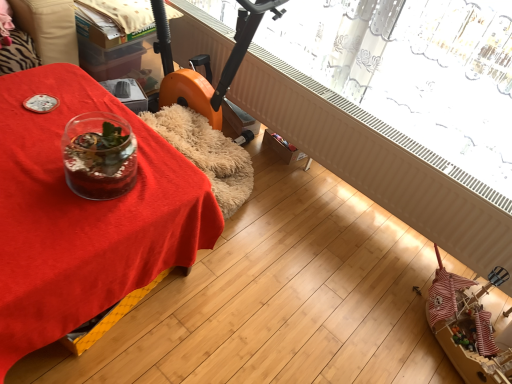
What do you see at coordinates (388, 132) in the screenshot?
I see `transparent glass window at upper center` at bounding box center [388, 132].

At what (x,y) coordinates should I click in order to perform the action: click on transparent glass window at upper center. Please return your answer as a coordinate pair (x, y). This screenshot has height=384, width=512. Looking at the image, I should click on click(x=388, y=132).

Describe the element at coordinates (84, 215) in the screenshot. I see `transparent glass vase at left` at that location.

This screenshot has height=384, width=512. I want to click on transparent glass vase at left, so click(84, 215).

I want to click on transparent glass window at upper center, so click(x=388, y=132).

Which is more to the left, transparent glass window at upper center or transparent glass vase at left?

Positioned to the left is transparent glass vase at left.

Which object is more forward, transparent glass window at upper center or transparent glass vase at left?

transparent glass vase at left is more forward.

Is point (322, 88) farther from viewer compared to point (24, 72)?

Yes, point (322, 88) is farther from viewer.

From the image's perspective, which is above, transparent glass window at upper center or transparent glass vase at left?

transparent glass window at upper center.

From a real-world perspective, between transparent glass window at upper center and transparent glass vase at left, who is vertically higher?

transparent glass window at upper center.

Is transparent glass window at upper center wider or thinner than transparent glass vase at left?

transparent glass window at upper center is thinner than transparent glass vase at left.

Based on the photo, in terms of height, does transparent glass window at upper center look taller or shorter compared to transparent glass vase at left?

In the image, transparent glass window at upper center appears to be shorter than transparent glass vase at left.

Between transparent glass window at upper center and transparent glass vase at left, which one has larger size?

Bigger between the two is transparent glass vase at left.

Is transparent glass vase at left completely or partially inside transparent glass window at upper center?

No, transparent glass vase at left is not surrounded by transparent glass window at upper center.

Is there a large distance between transparent glass window at upper center and transparent glass vase at left?

Yes, transparent glass window at upper center and transparent glass vase at left are quite far apart.

Looking at this image, does transparent glass window at upper center turn towards transparent glass vase at left?

Yes, transparent glass window at upper center is aimed at transparent glass vase at left.

How distant is transparent glass window at upper center from transparent glass vase at left?

The distance of transparent glass window at upper center from transparent glass vase at left is 1.02 meters.

Image resolution: width=512 pixels, height=384 pixels. Identify the location of table on the left of transparent glass window at upper center. (84, 215).

Visually, is transparent glass vase at left positioned to the left or to the right of transparent glass window at upper center?

transparent glass vase at left is positioned on transparent glass window at upper center's left side.

From the picture: Between transparent glass vase at left and transparent glass window at upper center, which one is positioned behind?

transparent glass window at upper center is behind.

Which is in front, point (96, 300) or point (425, 160)?

The point (96, 300) is in front.

From the image's perspective, is transparent glass vase at left located beneath transparent glass window at upper center?

Correct, transparent glass vase at left appears lower than transparent glass window at upper center in the image.

From a real-world perspective, is transparent glass vase at left physically located above or below transparent glass window at upper center?

In terms of real-world spatial position, transparent glass vase at left is below transparent glass window at upper center.

Consider the image. Considering the sizes of objects transparent glass vase at left and transparent glass window at upper center in the image provided, who is thinner, transparent glass vase at left or transparent glass window at upper center?

Thinner between the two is transparent glass window at upper center.

Does transparent glass vase at left have a lesser height compared to transparent glass window at upper center?

In fact, transparent glass vase at left may be taller than transparent glass window at upper center.

Based on their sizes in the image, would you say transparent glass vase at left is bigger or smaller than transparent glass window at upper center?

Considering their sizes, transparent glass vase at left takes up more space than transparent glass window at upper center.

Is transparent glass vase at left situated inside transparent glass window at upper center or outside?

The correct answer is: outside.

Can you see transparent glass vase at left touching transparent glass window at upper center?

They are not placed beside each other.

Is transparent glass window at upper center at the back of transparent glass vase at left?

Yes, transparent glass window at upper center is at the back of transparent glass vase at left.

How many degrees apart are the facing directions of transparent glass vase at left and transparent glass window at upper center?

They differ by 0.459 degrees in their facing directions.

Where is `table on the left of transparent glass window at upper center`? Image resolution: width=512 pixels, height=384 pixels. table on the left of transparent glass window at upper center is located at coordinates (84, 215).

At what (x,y) coordinates should I click in order to perform the action: click on table below the transparent glass window at upper center (from the image's perspective). Please return your answer as a coordinate pair (x, y). The image size is (512, 384). Looking at the image, I should click on (84, 215).

This screenshot has width=512, height=384. I want to click on table located on the left of transparent glass window at upper center, so click(84, 215).